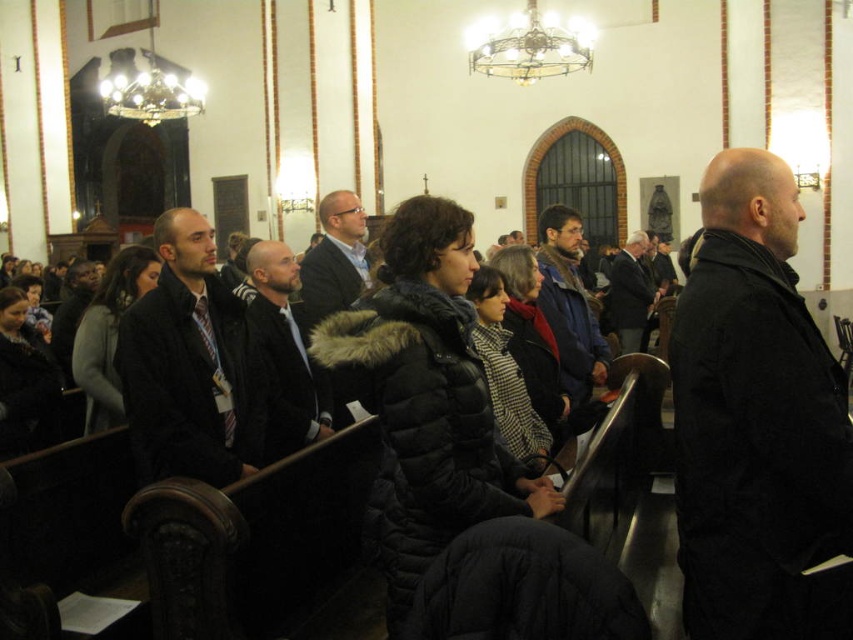
Which is below, dark blue jacket at center or matte black jacket at center?

Positioned lower is matte black jacket at center.

Who is shorter, dark blue jacket at center or matte black jacket at center?

matte black jacket at center is shorter.

Where is `dark blue jacket at center`? The width and height of the screenshot is (853, 640). dark blue jacket at center is located at coordinates (569, 304).

Is point (306, 387) less distant than point (358, 275)?

Yes, point (306, 387) is closer to viewer.

Which is more to the right, dark brown leather jacket at center or matte black jacket at center?

From the viewer's perspective, matte black jacket at center appears more on the right side.

I want to click on dark brown leather jacket at center, so click(281, 353).

Does dark gray jacket at center appear under matte black jacket at center?

Yes, dark gray jacket at center is below matte black jacket at center.

Is the position of dark gray jacket at center more distant than that of matte black jacket at center?

No, dark gray jacket at center is closer to the viewer.

What do you see at coordinates (189, 364) in the screenshot? I see `dark gray jacket at center` at bounding box center [189, 364].

I want to click on dark gray jacket at center, so click(x=189, y=364).